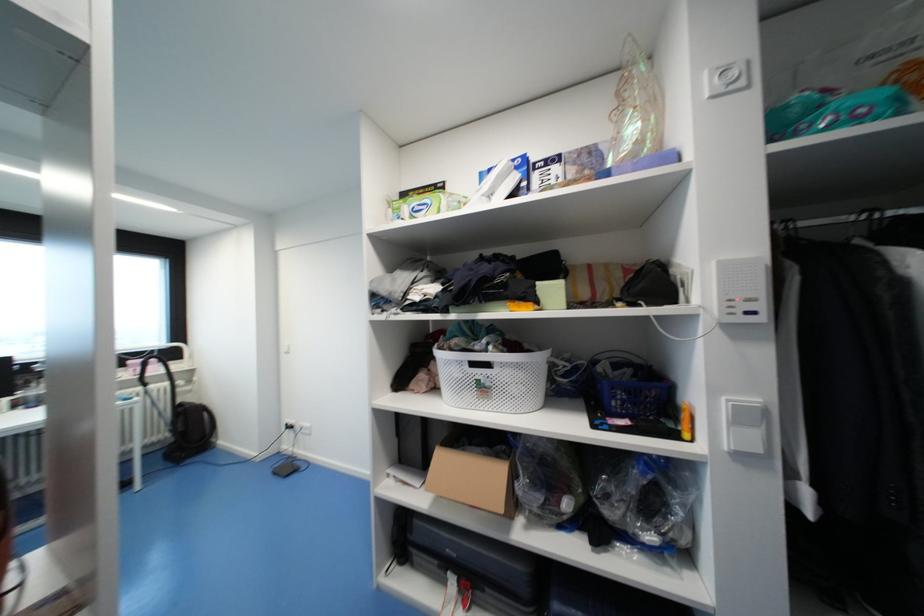
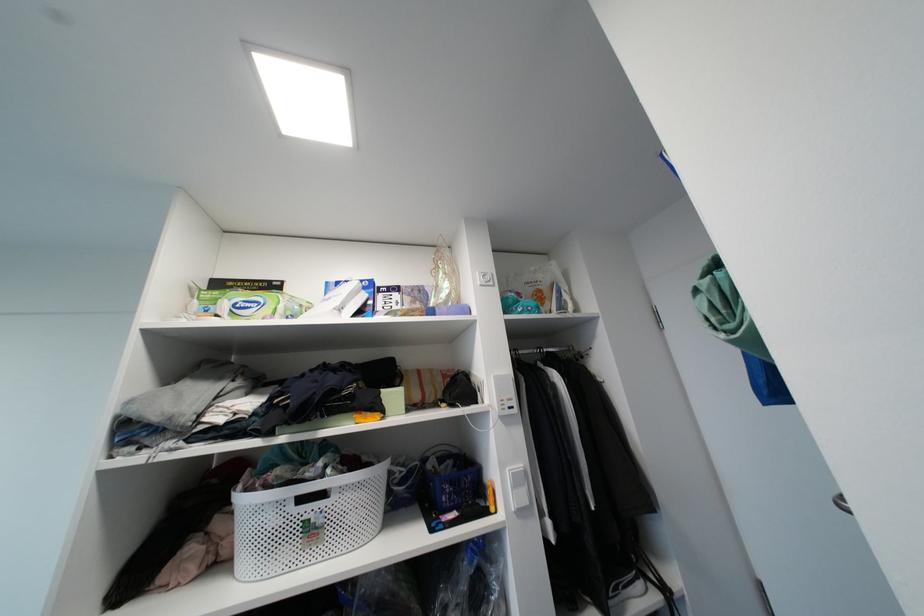
Locate, in the second image, the point that corresponds to point (736, 87) in the first image.

(492, 284)